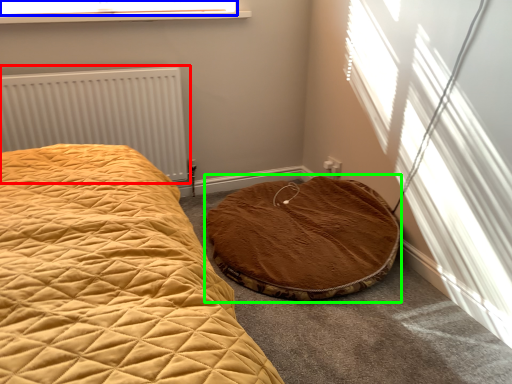
Question: Which is farther away from radiator (highlighted by a red box)? window screen (highlighted by a blue box) or cat bed (highlighted by a green box)?

Choices:
 (A) window screen
 (B) cat bed

Answer: (B)